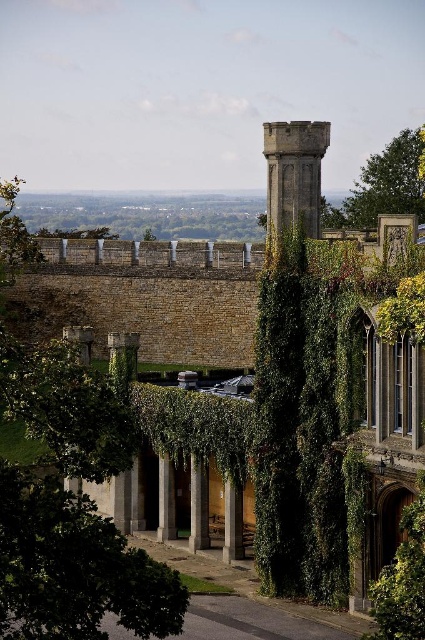
Question: Which point appears closest to the camera in this image?

Choices:
 (A) (413, 148)
 (B) (68, 593)
 (C) (314, 225)

Answer: (B)

Question: Can you confirm if green leafy tree at left is bigger than green leafy tree at upper right?

Choices:
 (A) no
 (B) yes

Answer: (B)

Question: Among these points, which one is nearest to the camera?

Choices:
 (A) (404, 131)
 (B) (277, 170)

Answer: (B)

Question: Can you confirm if green leafy tree at left is bigger than stone tower at upper center?

Choices:
 (A) no
 (B) yes

Answer: (B)

Question: Is green leafy tree at left closer to camera compared to green leafy tree at upper right?

Choices:
 (A) yes
 (B) no

Answer: (A)

Question: Among these objects, which one is nearest to the camera?

Choices:
 (A) green leafy tree at upper right
 (B) stone tower at upper center

Answer: (B)